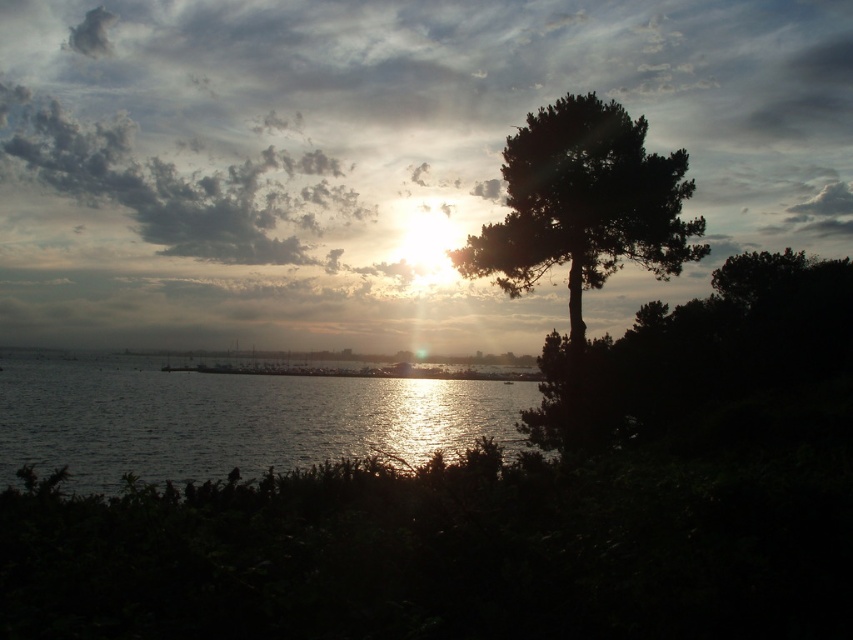
You are standing on the beach and see the glistening water at center and the dark green leafy tree at right. Which object is nearer to you?

→ The glistening water at center is closer to the viewer than the dark green leafy tree at right.

You are a photographer trying to capture the sunset. You notice the glistening water at center and the dark green leafy tree at right in your viewfinder. Which object should you focus on if you want to highlight the largest area in your photo?

The glistening water at center might be wider than dark green leafy tree at right, so focusing on the glistening water at center would likely capture the largest area in the photo.

You are a photographer aiming to capture the perfect shot of the coastal scene. You notice two points in your viewfinder labeled as point (x=445, y=381) and point (x=566, y=116). If you want to focus on the closer point to ensure sharpness, which point should you choose?

Point (x=566, y=116) is closer to the camera than point (x=445, y=381), so you should focus on point (x=566, y=116) to ensure sharpness.